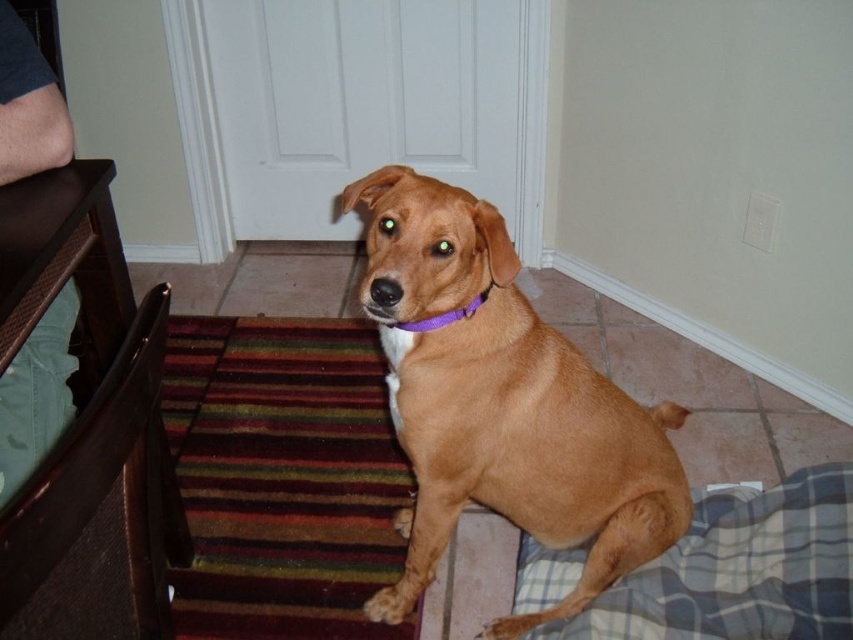
Question: Does brown matte dog at center have a smaller size compared to brown leather chair at lower left?

Choices:
 (A) no
 (B) yes

Answer: (A)

Question: Among these objects, which one is farthest from the camera?

Choices:
 (A) brown matte dog at center
 (B) purple fabric neckband at center
 (C) plaid fabric dog bed at lower right
 (D) brown leather chair at lower left

Answer: (C)

Question: Does brown leather chair at lower left lie in front of plaid fabric dog bed at lower right?

Choices:
 (A) no
 (B) yes

Answer: (B)

Question: Observing the image, what is the correct spatial positioning of brown matte dog at center in reference to brown leather chair at lower left?

Choices:
 (A) below
 (B) above

Answer: (B)

Question: Estimate the real-world distances between objects in this image. Which object is farther from the brown matte dog at center?

Choices:
 (A) purple fabric neckband at center
 (B) plaid fabric dog bed at lower right
 (C) brown leather chair at lower left

Answer: (C)

Question: Which of the following is the closest to the observer?

Choices:
 (A) plaid fabric dog bed at lower right
 (B) brown matte dog at center
 (C) brown leather chair at lower left

Answer: (C)